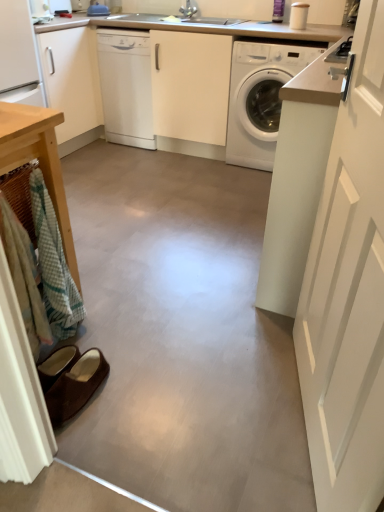
At what (x,y) coordinates should I click in order to perform the action: click on free space between wooden table at left and white matte door at right. Please return your answer as a coordinate pair (x, y). The height and width of the screenshot is (512, 384). Looking at the image, I should click on (192, 381).